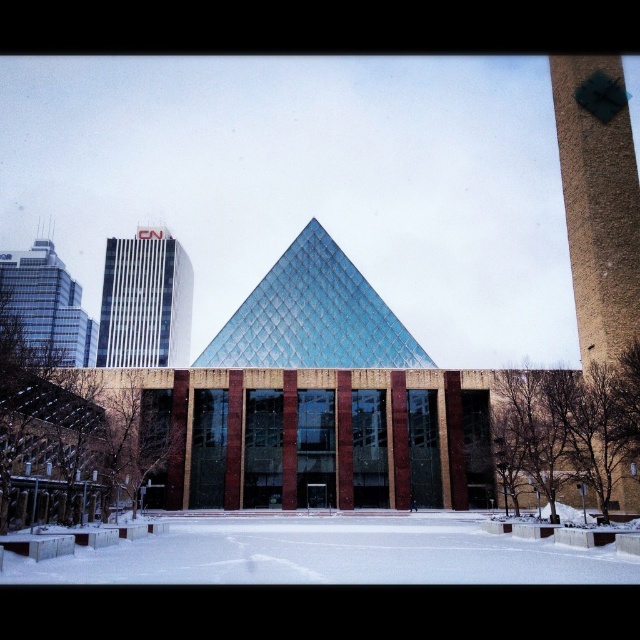
Question: Does brown textured tower at right have a smaller size compared to white glass building at upper left?

Choices:
 (A) yes
 (B) no

Answer: (A)

Question: Which of the following is the closest to the observer?

Choices:
 (A) brown textured tower at right
 (B) glassy reflective skyscraper at left

Answer: (A)

Question: Does white glass building at upper left have a larger size compared to glassy reflective skyscraper at left?

Choices:
 (A) yes
 (B) no

Answer: (B)

Question: Is brown textured tower at right closer to the viewer compared to glassy reflective skyscraper at left?

Choices:
 (A) yes
 (B) no

Answer: (A)

Question: Which of these objects is positioned closest to the glassy reflective skyscraper at left?

Choices:
 (A) brown textured tower at right
 (B) white glass building at upper left

Answer: (B)

Question: Estimate the real-world distances between objects in this image. Which object is closer to the brown textured tower at right?

Choices:
 (A) glassy reflective skyscraper at left
 (B) white glass building at upper left

Answer: (B)